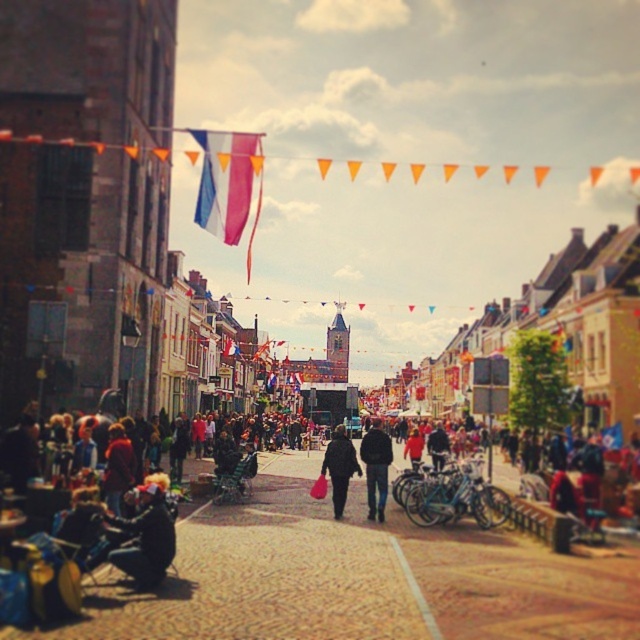
Can you confirm if dark blue jacket at lower left is taller than matte black jacket at center?

No.

Can you confirm if dark blue jacket at lower left is smaller than matte black jacket at center?

Indeed, dark blue jacket at lower left has a smaller size compared to matte black jacket at center.

Is point (172, 536) more distant than point (413, 433)?

That is False.

The height and width of the screenshot is (640, 640). Find the location of `dark blue jacket at lower left`. dark blue jacket at lower left is located at coordinates (147, 536).

Is matte brown cobblestone at center to the right of matte black jacket at center from the viewer's perspective?

No, matte brown cobblestone at center is not to the right of matte black jacket at center.

Is matte brown cobblestone at center wider than matte black jacket at center?

Indeed, matte brown cobblestone at center has a greater width compared to matte black jacket at center.

Which is behind, point (300, 520) or point (417, 436)?

The point (417, 436) is behind.

Locate an element on the screen. matte brown cobblestone at center is located at coordinates (358, 577).

Is dark blue jeans at center above matte black jacket at center?

No, dark blue jeans at center is not above matte black jacket at center.

The width and height of the screenshot is (640, 640). In order to click on dark blue jeans at center in this screenshot , I will do click(376, 467).

Locate an element on the screen. dark blue jeans at center is located at coordinates (376, 467).